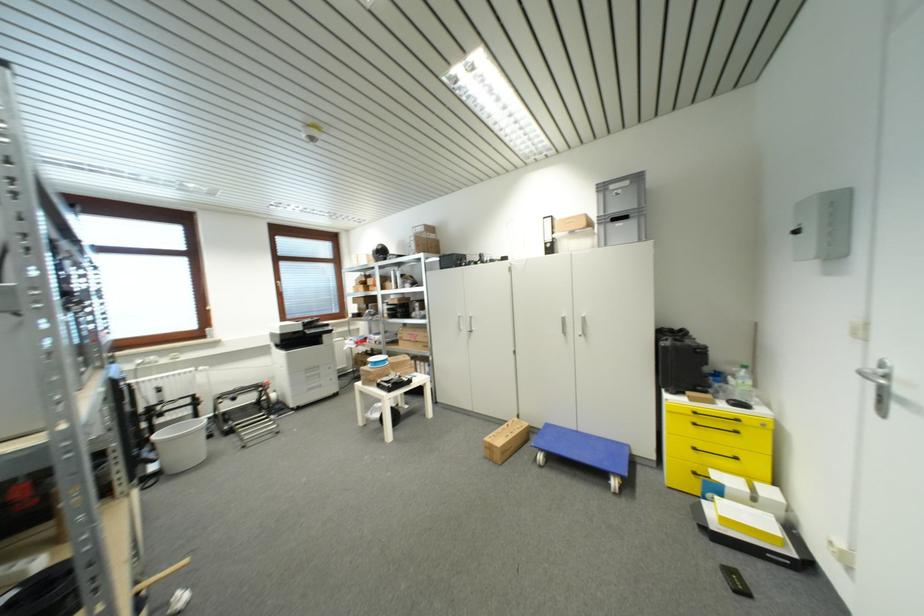
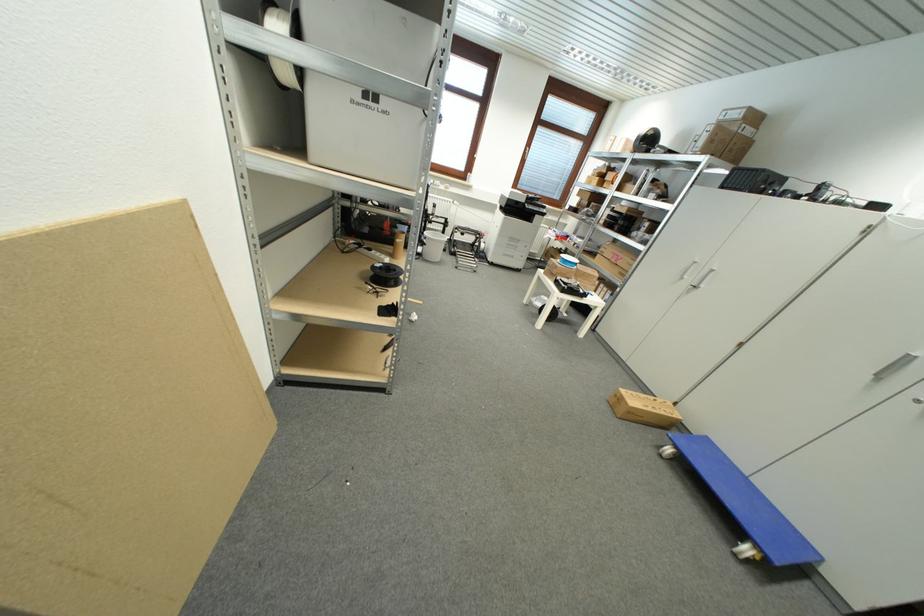
In the second image, find the point that corresponds to the point at 157,435 in the first image.

(430, 233)